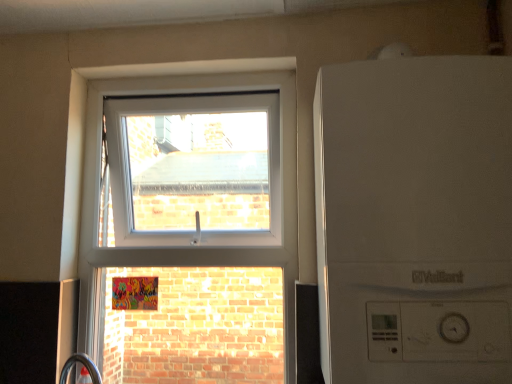
Question: Would you consider transparent glass window at upper center to be distant from white matte boiler at upper center?

Choices:
 (A) no
 (B) yes

Answer: (A)

Question: From the image's perspective, would you say transparent glass window at upper center is positioned over white matte boiler at upper center?

Choices:
 (A) yes
 (B) no

Answer: (B)

Question: From a real-world perspective, is transparent glass window at upper center physically above white matte boiler at upper center?

Choices:
 (A) no
 (B) yes

Answer: (A)

Question: Can you confirm if transparent glass window at upper center is positioned to the right of white matte boiler at upper center?

Choices:
 (A) yes
 (B) no

Answer: (B)

Question: Is transparent glass window at upper center thinner than white matte boiler at upper center?

Choices:
 (A) yes
 (B) no

Answer: (A)

Question: Can you confirm if transparent glass window at upper center is bigger than white matte boiler at upper center?

Choices:
 (A) no
 (B) yes

Answer: (B)

Question: Considering the relative positions of white matte boiler at upper center and transparent glass window at upper center in the image provided, is white matte boiler at upper center to the left of transparent glass window at upper center from the viewer's perspective?

Choices:
 (A) yes
 (B) no

Answer: (B)

Question: Does white matte boiler at upper center appear on the right side of transparent glass window at upper center?

Choices:
 (A) yes
 (B) no

Answer: (A)

Question: Can you confirm if white matte boiler at upper center is smaller than transparent glass window at upper center?

Choices:
 (A) no
 (B) yes

Answer: (B)

Question: From a real-world perspective, is white matte boiler at upper center positioned under transparent glass window at upper center based on gravity?

Choices:
 (A) no
 (B) yes

Answer: (A)

Question: Considering the relative sizes of white matte boiler at upper center and transparent glass window at upper center in the image provided, is white matte boiler at upper center taller than transparent glass window at upper center?

Choices:
 (A) no
 (B) yes

Answer: (A)

Question: Is white matte boiler at upper center outside transparent glass window at upper center?

Choices:
 (A) no
 (B) yes

Answer: (B)

Question: Is transparent glass window at upper center to the left or to the right of white matte boiler at upper center in the image?

Choices:
 (A) right
 (B) left

Answer: (B)